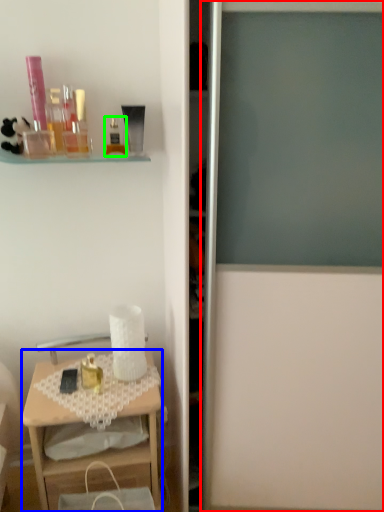
Question: Estimate the real-world distances between objects in this image. Which object is farther from screen door (highlighted by a red box), desk (highlighted by a blue box) or toiletry (highlighted by a green box)?

Choices:
 (A) desk
 (B) toiletry

Answer: (B)